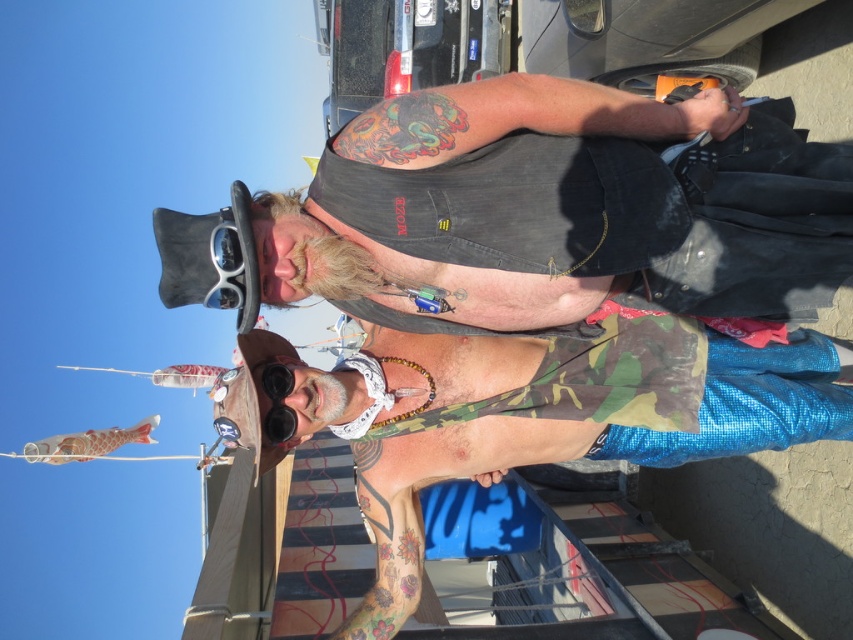
Question: Is denim vest at center to the left of black rubber goggles at center from the viewer's perspective?

Choices:
 (A) yes
 (B) no

Answer: (B)

Question: Is camo fabric tank top at center below black rubber goggles at center?

Choices:
 (A) no
 (B) yes

Answer: (B)

Question: Which point is closer to the camera?

Choices:
 (A) (289, 376)
 (B) (688, 124)

Answer: (B)

Question: Which object is closer to the camera taking this photo?

Choices:
 (A) camo fabric tank top at center
 (B) denim vest at center
 (C) black rubber goggles at center
 (D) white plastic goggles at upper center

Answer: (D)

Question: Considering the relative positions of denim vest at center and camo fabric tank top at center in the image provided, where is denim vest at center located with respect to camo fabric tank top at center?

Choices:
 (A) left
 (B) right

Answer: (A)

Question: Among these points, which one is nearest to the camera?

Choices:
 (A) (183, 220)
 (B) (227, 237)
 (C) (293, 378)
 (D) (265, 342)

Answer: (B)